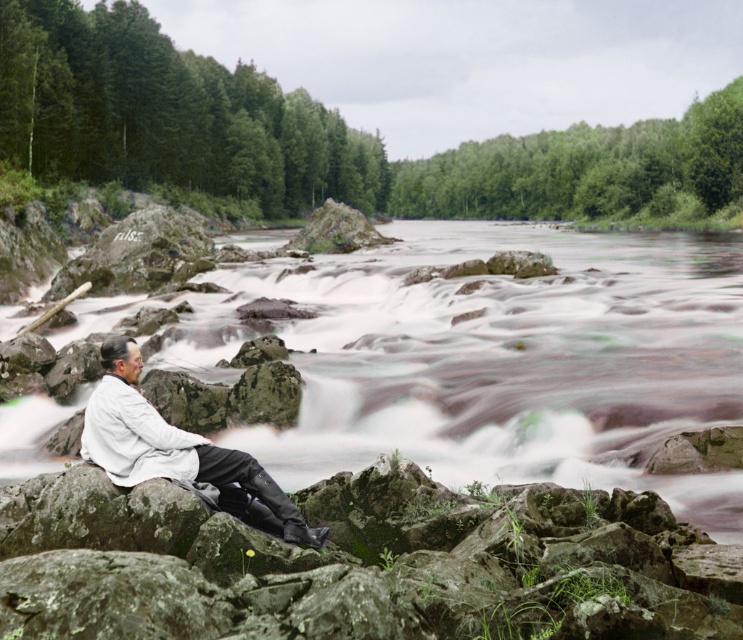
Question: Is white frothy water at center wider than white matte shirt at lower left?

Choices:
 (A) yes
 (B) no

Answer: (A)

Question: Which object is farther from the camera taking this photo?

Choices:
 (A) white matte shirt at lower left
 (B) white frothy water at center

Answer: (B)

Question: In this image, where is white frothy water at center located relative to white matte shirt at lower left?

Choices:
 (A) right
 (B) left

Answer: (A)

Question: Does white frothy water at center have a larger size compared to white matte shirt at lower left?

Choices:
 (A) no
 (B) yes

Answer: (B)